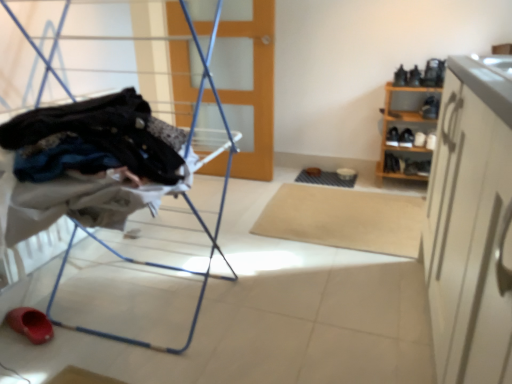
Question: Based on their positions, is metal laundry rack at left located to the left or right of rubber/soft sole shoe at lower left?

Choices:
 (A) left
 (B) right

Answer: (B)

Question: Is metal laundry rack at left in front of or behind rubber/soft sole shoe at lower left in the image?

Choices:
 (A) behind
 (B) front

Answer: (B)

Question: Estimate the real-world distances between objects in this image. Which object is closer to the wooden shoe rack at right?

Choices:
 (A) metal laundry rack at left
 (B) rubber/soft sole shoe at lower left
 (C) wooden at center
 (D) beige carpet at center

Answer: (D)

Question: Estimate the real-world distances between objects in this image. Which object is closer to the metal laundry rack at left?

Choices:
 (A) rubber/soft sole shoe at lower left
 (B) wooden at center
 (C) wooden shoe rack at right
 (D) beige carpet at center

Answer: (A)